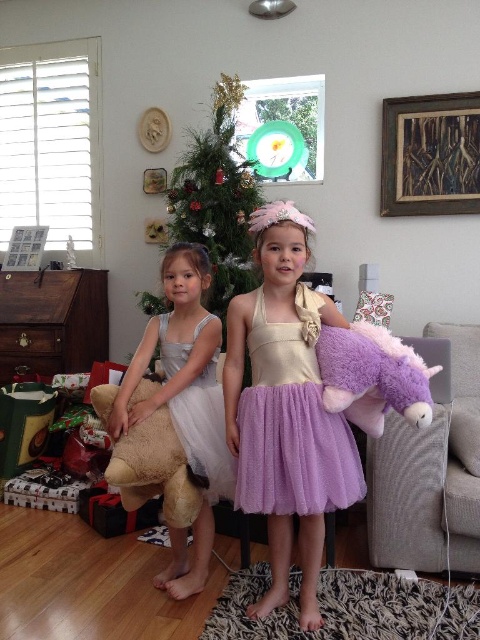
Does soft brown teddy bear at lower left appear on the left side of white tulle dress at center?

Correct, you'll find soft brown teddy bear at lower left to the left of white tulle dress at center.

Does point (107, 392) come in front of point (193, 460)?

No.

At what (x,y) coordinates should I click in order to perform the action: click on soft brown teddy bear at lower left. Please return your answer as a coordinate pair (x, y). This screenshot has height=640, width=480. Looking at the image, I should click on (154, 468).

Does lavender tulle skirt at center appear under purple plush unicorn at right?

Yes, lavender tulle skirt at center is below purple plush unicorn at right.

Who is more distant from viewer, (350,448) or (369,364)?

Positioned behind is point (350,448).

Identify the location of lavender tulle skirt at center. This screenshot has height=640, width=480. (294, 452).

Which is more to the right, silvery tulle dress at left or soft brown teddy bear at lower left?

From the viewer's perspective, silvery tulle dress at left appears more on the right side.

Who is higher up, silvery tulle dress at left or soft brown teddy bear at lower left?

Positioned higher is silvery tulle dress at left.

You are a GUI agent. You are given a task and a screenshot of the screen. Output one action in this format:
    pyautogui.click(x=<x>, y=<y>)
    Task: Click on the silvery tulle dress at left
    This screenshot has width=480, height=640.
    Given the screenshot: What is the action you would take?
    pyautogui.click(x=184, y=404)

Locate an element on the screen. silvery tulle dress at left is located at coordinates (184, 404).